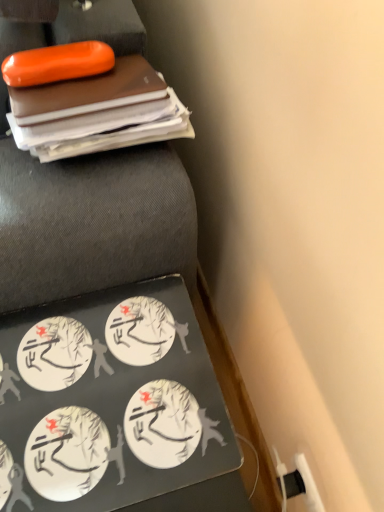
Question: Is black matte laptop at lower left to the left of white matte stickers at bottom left from the viewer's perspective?

Choices:
 (A) yes
 (B) no

Answer: (A)

Question: Is black matte laptop at lower left to the right of white matte stickers at bottom left from the viewer's perspective?

Choices:
 (A) yes
 (B) no

Answer: (B)

Question: From a real-world perspective, is black matte laptop at lower left located beneath white matte stickers at bottom left?

Choices:
 (A) no
 (B) yes

Answer: (A)

Question: Is black matte laptop at lower left beside white matte stickers at bottom left?

Choices:
 (A) no
 (B) yes

Answer: (A)

Question: Considering the relative sizes of black matte laptop at lower left and white matte stickers at bottom left in the image provided, is black matte laptop at lower left taller than white matte stickers at bottom left?

Choices:
 (A) no
 (B) yes

Answer: (B)

Question: Would you say black matte laptop at lower left is a long distance from white matte stickers at bottom left?

Choices:
 (A) no
 (B) yes

Answer: (A)

Question: Can you confirm if white matte stickers at bottom left is positioned to the left of black matte laptop at lower left?

Choices:
 (A) no
 (B) yes

Answer: (A)

Question: From the image's perspective, is white matte stickers at bottom left under black matte laptop at lower left?

Choices:
 (A) yes
 (B) no

Answer: (A)

Question: Is white matte stickers at bottom left taller than black matte laptop at lower left?

Choices:
 (A) yes
 (B) no

Answer: (B)

Question: Is white matte stickers at bottom left completely or partially outside of black matte laptop at lower left?

Choices:
 (A) yes
 (B) no

Answer: (A)

Question: Is white matte stickers at bottom left at the right side of black matte laptop at lower left?

Choices:
 (A) yes
 (B) no

Answer: (A)

Question: Could black matte laptop at lower left be considered to be inside white matte stickers at bottom left?

Choices:
 (A) yes
 (B) no

Answer: (B)

Question: Is white matte stickers at bottom left wider or thinner than black matte laptop at lower left?

Choices:
 (A) thin
 (B) wide

Answer: (A)